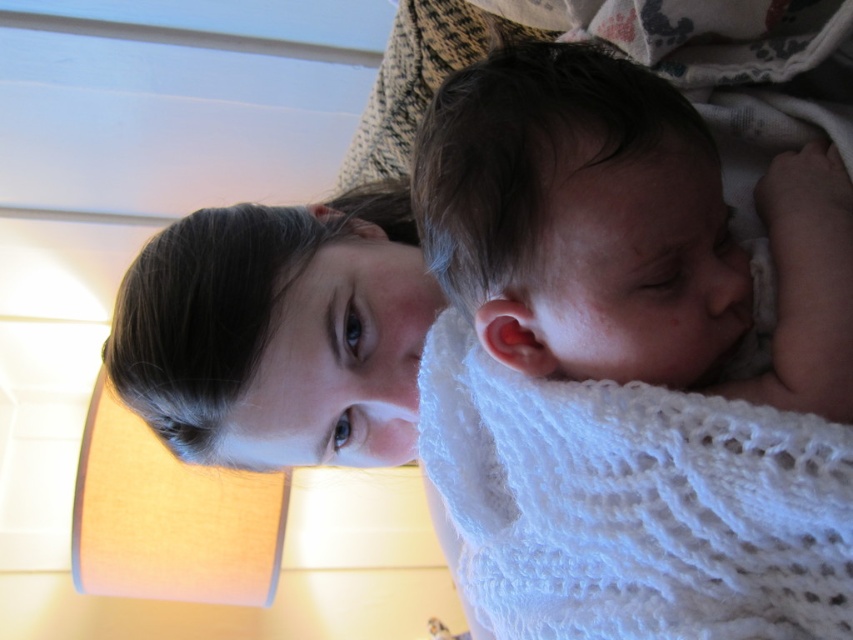
Does smooth white swaddling at right appear over smooth skin face at upper center?

Yes, smooth white swaddling at right is above smooth skin face at upper center.

Consider the image. Is smooth white swaddling at right bigger than smooth skin face at upper center?

No.

Does point (612, 157) come in front of point (351, 298)?

Yes.

This screenshot has height=640, width=853. Find the location of `smooth white swaddling at right`. smooth white swaddling at right is located at coordinates (625, 230).

Based on the photo, between smooth white swaddling at right and white knitted wrap at lower right, which one has more height?

With more height is white knitted wrap at lower right.

Is smooth white swaddling at right shorter than white knitted wrap at lower right?

Yes, smooth white swaddling at right is shorter than white knitted wrap at lower right.

Who is more distant from viewer, (579, 349) or (764, 417)?

The point (579, 349) is more distant.

Where is `smooth white swaddling at right`? smooth white swaddling at right is located at coordinates (625, 230).

Consider the image. Which of these two, white knitted wrap at lower right or smooth skin face at upper center, stands taller?

white knitted wrap at lower right

Can you confirm if white knitted wrap at lower right is thinner than smooth skin face at upper center?

Indeed, white knitted wrap at lower right has a lesser width compared to smooth skin face at upper center.

Locate an element on the screen. This screenshot has width=853, height=640. white knitted wrap at lower right is located at coordinates (631, 506).